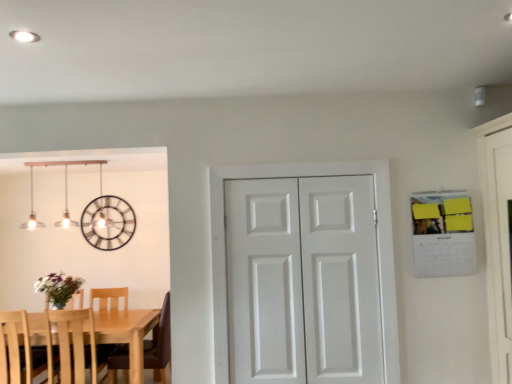
Question: Are light wood table at lower left and light wood chair at left, the 2th chair in the left-to-right sequence, beside each other?

Choices:
 (A) no
 (B) yes

Answer: (A)

Question: Are light wood table at lower left and light wood chair at left, which ranks as the 1th chair in right-to-left order, located far from each other?

Choices:
 (A) no
 (B) yes

Answer: (A)

Question: Could you tell me if light wood table at lower left is turned towards light wood chair at left, which ranks as the 1th chair in right-to-left order?

Choices:
 (A) yes
 (B) no

Answer: (A)

Question: Considering the relative positions of light wood table at lower left and light wood chair at left, which ranks as the 1th chair in right-to-left order, in the image provided, is light wood table at lower left in front of light wood chair at left, which ranks as the 1th chair in right-to-left order,?

Choices:
 (A) no
 (B) yes

Answer: (A)

Question: Is light wood chair at left, which ranks as the 1th chair in right-to-left order, at the back of light wood table at lower left?

Choices:
 (A) no
 (B) yes

Answer: (B)

Question: Considering the positions of white matte door at center, which is the second screen door from right to left, and metallic clock at upper left in the image, is white matte door at center, which is the second screen door from right to left, bigger or smaller than metallic clock at upper left?

Choices:
 (A) big
 (B) small

Answer: (B)

Question: Considering the positions of point (245, 279) and point (121, 238), is point (245, 279) closer or farther from the camera than point (121, 238)?

Choices:
 (A) farther
 (B) closer

Answer: (B)

Question: Considering their positions, is white matte door at center, which is the 1th screen door in left-to-right order, located in front of or behind metallic clock at upper left?

Choices:
 (A) front
 (B) behind

Answer: (A)

Question: Based on their positions, is white matte door at center, which is the 1th screen door in left-to-right order, located to the left or right of metallic clock at upper left?

Choices:
 (A) left
 (B) right

Answer: (B)

Question: Is metallic clock at upper left inside or outside of light wood chair at left, the 2th chair in the left-to-right sequence?

Choices:
 (A) outside
 (B) inside

Answer: (A)

Question: Is metallic clock at upper left to the left or to the right of light wood chair at left, which ranks as the 1th chair in right-to-left order, in the image?

Choices:
 (A) right
 (B) left

Answer: (B)

Question: From a real-world perspective, is metallic clock at upper left above or below light wood chair at left, the 2th chair in the left-to-right sequence?

Choices:
 (A) above
 (B) below

Answer: (A)

Question: In terms of height, does metallic clock at upper left look taller or shorter compared to light wood chair at left, which ranks as the 1th chair in right-to-left order?

Choices:
 (A) short
 (B) tall

Answer: (A)

Question: From their relative heights in the image, would you say light wood table at lower left is taller or shorter than matte silver pendant lights at upper left?

Choices:
 (A) short
 (B) tall

Answer: (B)

Question: From the image's perspective, relative to matte silver pendant lights at upper left, is light wood table at lower left above or below?

Choices:
 (A) above
 (B) below

Answer: (B)